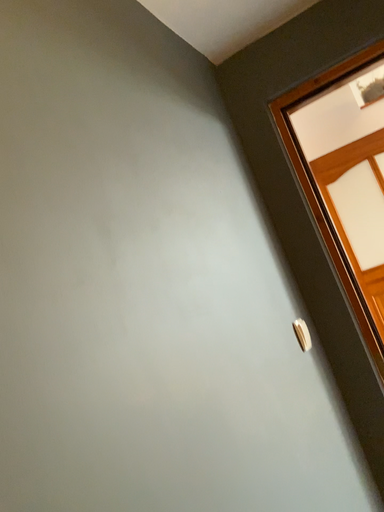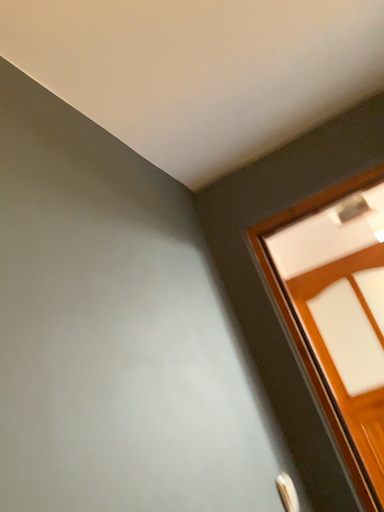
Question: Which way did the camera rotate in the video?

Choices:
 (A) rotated downward
 (B) rotated upward

Answer: (B)